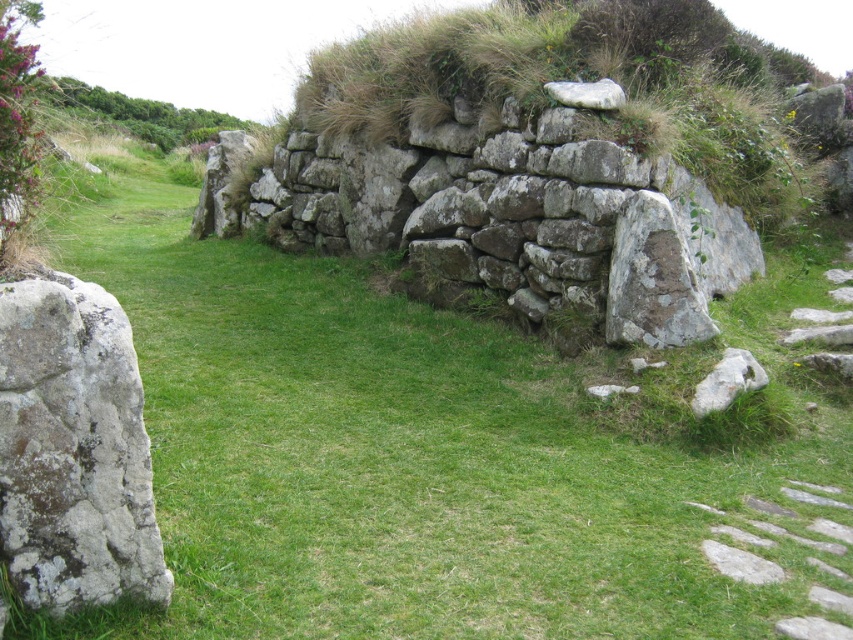
In the scene shown: You are a landscape architect designing a garden path that needs to fit between the natural stone wall at center and the speckled gray rock at left. Which object has a greater width, and thus requires more space to accommodate in your design?

The natural stone wall at center has a greater width than the speckled gray rock at left, so it requires more space in the design.

You are a hiker who has stumbled upon this ancient stone structure. You notice the natural stone wall at center and the speckled gray rock at left. Which object is positioned higher relative to the other?

The natural stone wall at center is positioned higher than the speckled gray rock at left because it is described as being above it.